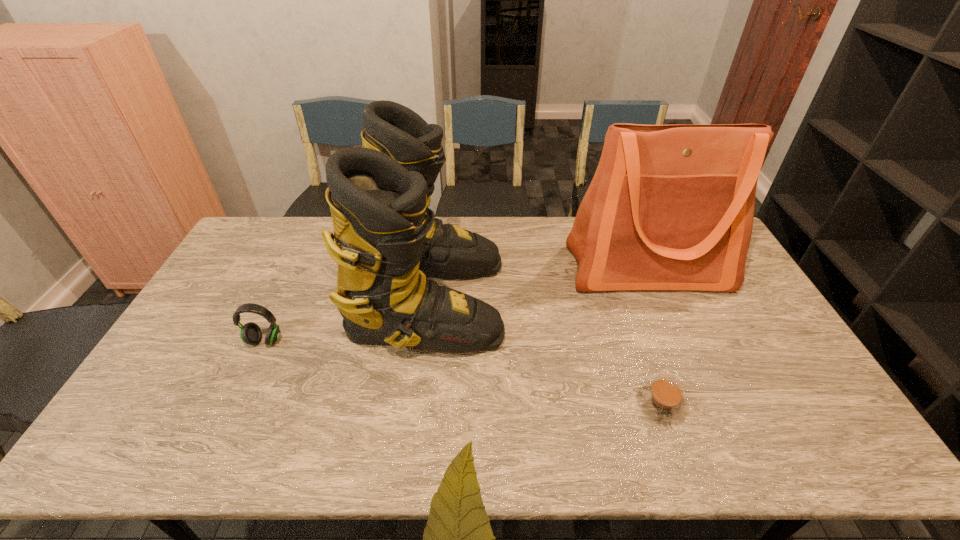
Locate an element on the screen. ski boots is located at coordinates (387, 240).

Locate an element on the screen. The height and width of the screenshot is (540, 960). shopping bag is located at coordinates (670, 207).

The image size is (960, 540). Identify the location of headset. (250, 333).

Locate an element on the screen. Image resolution: width=960 pixels, height=540 pixels. the second shortest object is located at coordinates (250, 333).

The image size is (960, 540). Identify the location of cappuccino. (663, 400).

In order to click on the shortest object in this screenshot , I will do `click(663, 400)`.

This screenshot has height=540, width=960. I want to click on free space located 0.200m on the right of the ski boots, so click(x=566, y=300).

This screenshot has height=540, width=960. Find the location of `vacant space situated on the front pocket of the shopping bag`. vacant space situated on the front pocket of the shopping bag is located at coordinates (707, 409).

This screenshot has width=960, height=540. I want to click on free location located 0.160m on the ear cups of the leftmost object, so click(x=237, y=399).

Locate an element on the screen. free region located on the left of the shortest object is located at coordinates (515, 404).